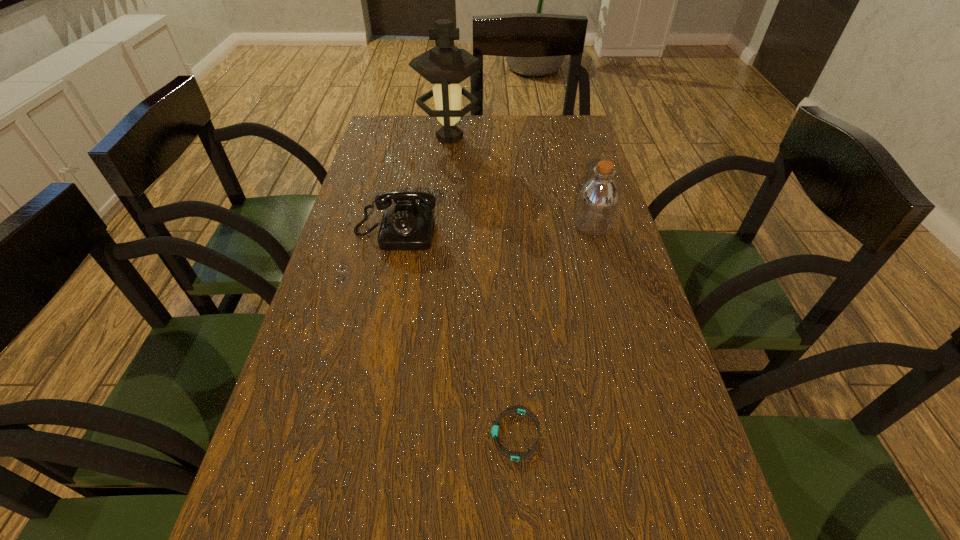
The width and height of the screenshot is (960, 540). I want to click on blank area located on the buckle of the wristband, so click(x=325, y=435).

Identify the location of free space located on the buckle of the wristband. (343, 435).

I want to click on free space located 0.340m on the buckle of the wristband, so click(298, 435).

Locate an element on the screen. This screenshot has height=540, width=960. object that is at the far edge is located at coordinates 445,65.

I want to click on oil lamp that is at the left edge, so click(445, 65).

Find the location of a particular element. Image resolution: width=960 pixels, height=540 pixels. telephone at the left edge is located at coordinates (407, 226).

Image resolution: width=960 pixels, height=540 pixels. In order to click on object at the right edge in this screenshot , I will do `click(597, 202)`.

Where is `object at the far left corner`? This screenshot has width=960, height=540. object at the far left corner is located at coordinates (445, 65).

Locate an element on the screen. free region at the far edge of the desktop is located at coordinates (506, 119).

This screenshot has width=960, height=540. In order to click on vacant space at the left edge of the desktop in this screenshot , I will do `click(380, 267)`.